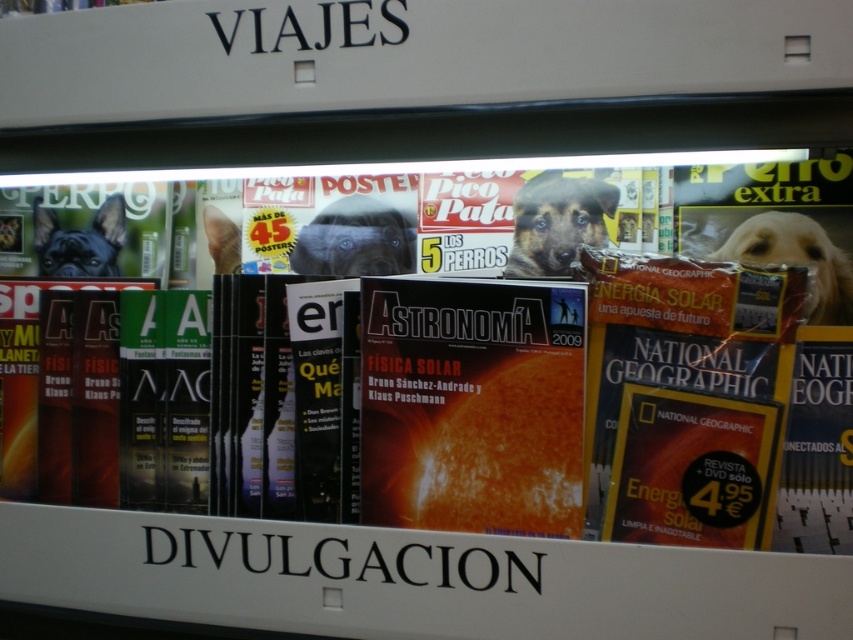
You are organizing a magazine rack and need to place the matte orange magazine at center and the black matte dog at left side by side. Which magazine requires more horizontal space on the rack?

The matte orange magazine at center requires more horizontal space because its width surpasses that of the black matte dog at left.

You are a customer in the bookstore looking to read the title of the orange matte magazine at center. However, there is a brown fur dog at center blocking your view. Can you see the magazine title clearly?

The orange matte magazine at center is positioned under the brown fur dog at center, so the dog is blocking the view of the magazine title.

You are standing in front of the magazine display and want to reach the point at coordinates point (780, 438) and point (541, 188). Which point is closer to you?

Point (780, 438) is in front of point (541, 188), so it is closer to you.